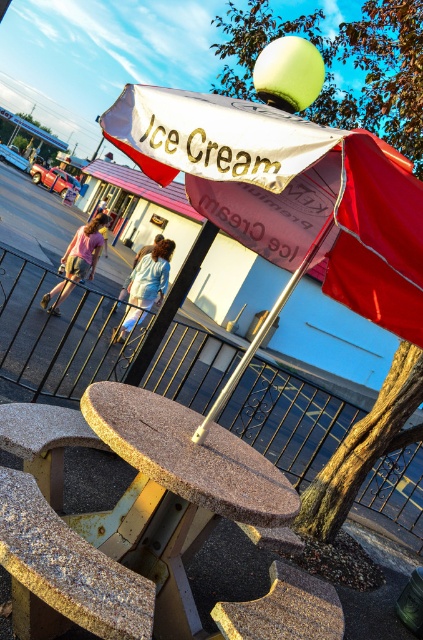
Question: Which of the following is the farthest from the observer?

Choices:
 (A) (41, 483)
 (B) (33, 483)
 (C) (376, 240)

Answer: (A)

Question: Can you confirm if rustic wood stool at lower left is smaller than granite-like stool at center?

Choices:
 (A) no
 (B) yes

Answer: (B)

Question: Which of the following is the farthest from the observer?

Choices:
 (A) [x=10, y=404]
 (B) [x=170, y=100]
 (C) [x=109, y=538]
 (D) [x=49, y=504]

Answer: (A)

Question: Is white fabric umbrella at center to the right of rustic wood stool at lower left from the viewer's perspective?

Choices:
 (A) yes
 (B) no

Answer: (A)

Question: Which object is farther from the camera taking this photo?

Choices:
 (A) granite table at center
 (B) white fabric umbrella at center
 (C) rustic wood stool at lower left

Answer: (A)

Question: Is granite table at center bigger than rustic wood stool at lower left?

Choices:
 (A) no
 (B) yes

Answer: (B)